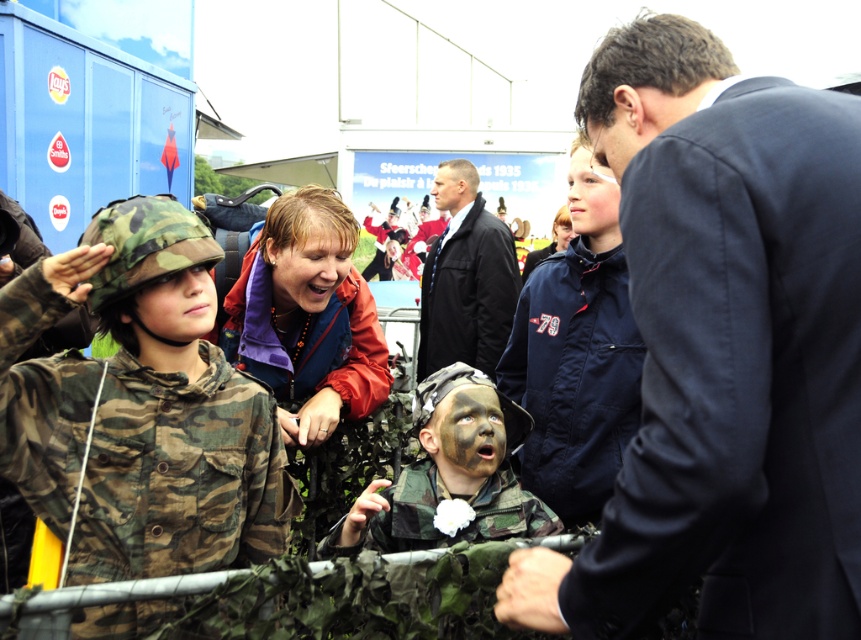
In the scene shown: You are a photographer at the event and want to take a photo of the camouflage paint face at center and the matte orange jacket at center. Based on their positions, which one should you focus on first if you want to capture both in the same frame?

The camouflage paint face at center is positioned on the right side of matte orange jacket at center, so you should focus on the matte orange jacket at center first to ensure both are in the frame.

You are a photographer at the event and want to capture a photo where the camouflage fabric at center is visible above the matte black face at center. Is this possible based on their current positions?

The camouflage fabric at center is currently below the matte black face at center, so adjusting the camera angle or moving the fabric upwards would be necessary to achieve the desired composition.

You are organizing a costume party and need to arrange the camo fabric uniform at left and the matte orange jacket at center on a display rack. The rack has two hooks spaced 30 inches apart. Will both items fit on the rack without overlapping?

The camo fabric uniform at left is 33.27 inches from matte orange jacket at center, which is wider than the 30 inches between the hooks. Therefore, the items will overlap if placed on the rack.